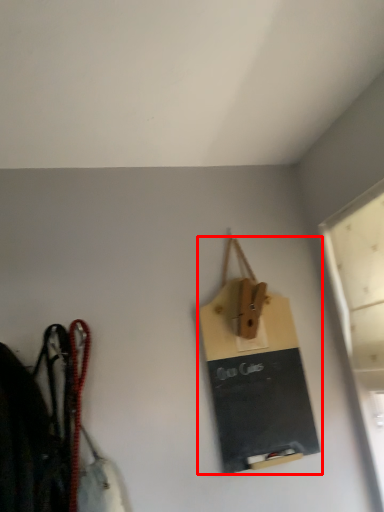
Question: Considering the relative positions of handbag (annotated by the red box) and window in the image provided, where is handbag (annotated by the red box) located with respect to the staircase?

Choices:
 (A) right
 (B) left

Answer: (B)